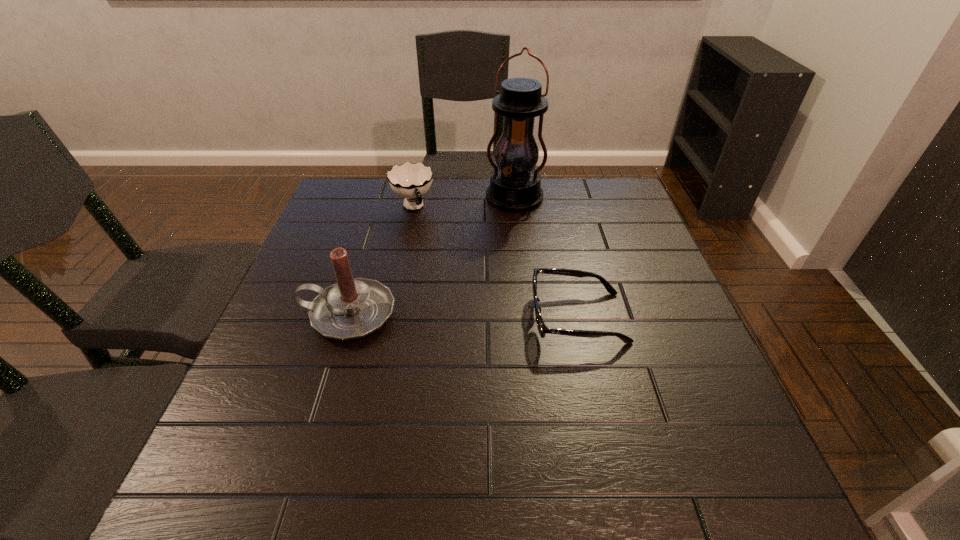
Find the location of a particular element. vacant space in between the candle and the lantern is located at coordinates (432, 256).

Locate an element on the screen. blank region between the shortest object and the lantern is located at coordinates (546, 258).

Identify the location of free space between the third tallest object and the candle. point(381,261).

The height and width of the screenshot is (540, 960). Identify the location of vacant area that lies between the lantern and the cup. (464, 203).

Point out which object is positioned as the second nearest to the candle. Please provide its 2D coordinates. Your answer should be formatted as a tuple, i.e. [(x, y)], where the tuple contains the x and y coordinates of a point satisfying the conditions above.

[(542, 328)]

Locate an element on the screen. This screenshot has height=540, width=960. the third closest object to the third tallest object is located at coordinates (542, 328).

The image size is (960, 540). What are the coordinates of `free location that satisfies the following two spatial constraints: 1. on the front side of the tallest object; 2. on the lenses of the shortest object` in the screenshot? It's located at (528, 318).

At what (x,y) coordinates should I click in order to perform the action: click on free space that satisfies the following two spatial constraints: 1. on the front side of the lantern; 2. on the lenses of the spectacles. Please return your answer as a coordinate pair (x, y). This screenshot has width=960, height=540. Looking at the image, I should click on (528, 318).

You are a GUI agent. You are given a task and a screenshot of the screen. Output one action in this format:
    pyautogui.click(x=<x>, y=<y>)
    Task: Click on the vacant space that satisfies the following two spatial constraints: 1. on the front side of the third tallest object; 2. on the lenses of the spectacles
    
    Given the screenshot: What is the action you would take?
    pyautogui.click(x=391, y=318)